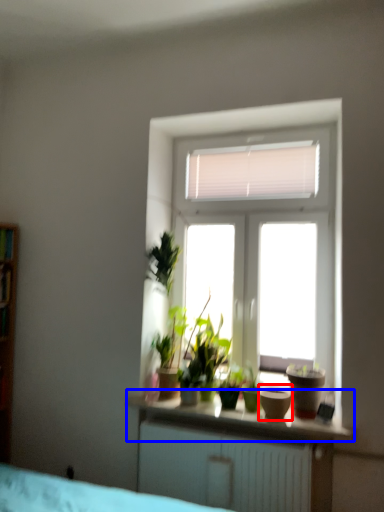
Question: Which object appears farthest to the camera in this image, flowerpot (highlighted by a red box) or window sill (highlighted by a blue box)?

Choices:
 (A) flowerpot
 (B) window sill

Answer: (A)